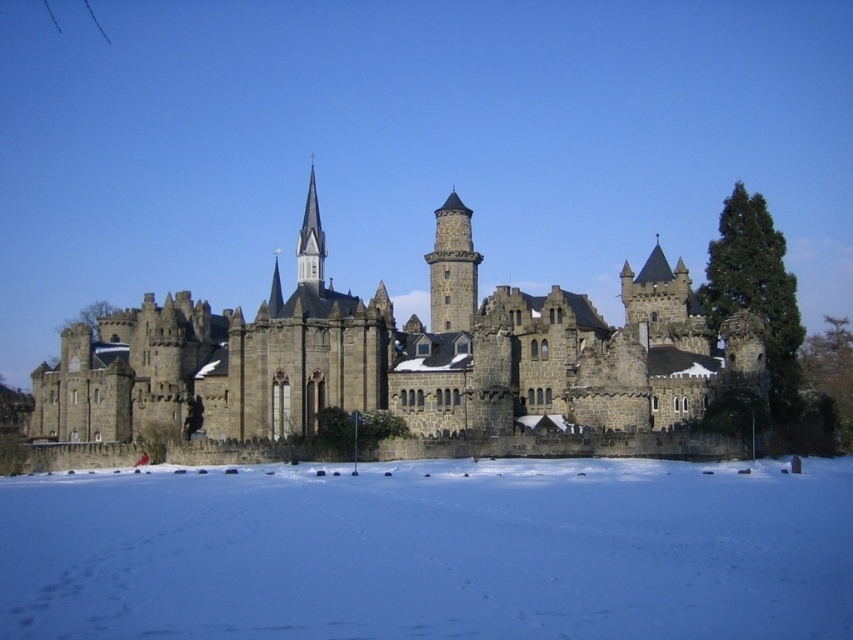
You are a knight approaching the castle and notice the white powdery snow at lower center and the dark gray stone tower at center. Which area is wider from your perspective?

The white powdery snow at lower center is wider than the dark gray stone tower at center.